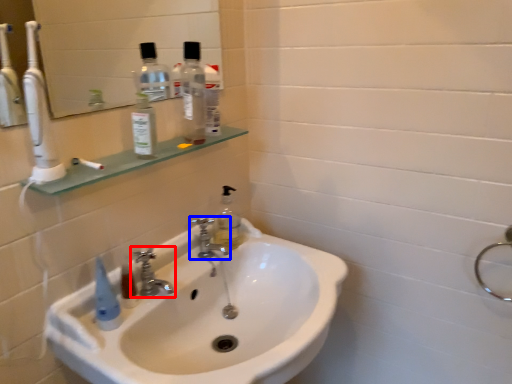
Question: Which object is closer to the camera taking this photo, tap (highlighted by a red box) or tap (highlighted by a blue box)?

Choices:
 (A) tap
 (B) tap

Answer: (A)